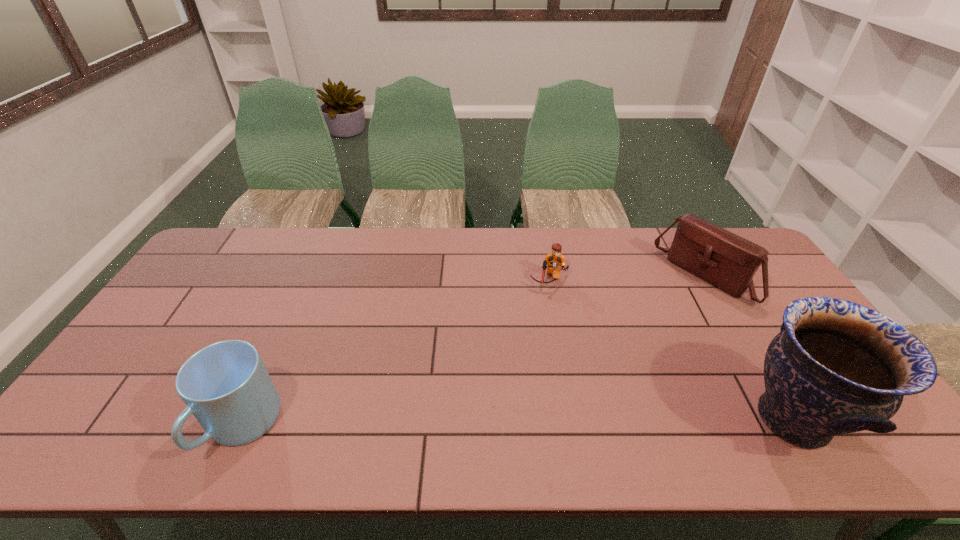
This screenshot has width=960, height=540. I want to click on vacant area that satisfies the following two spatial constraints: 1. on the front side of the tallest object; 2. on the front handle of the shortest object, so click(574, 419).